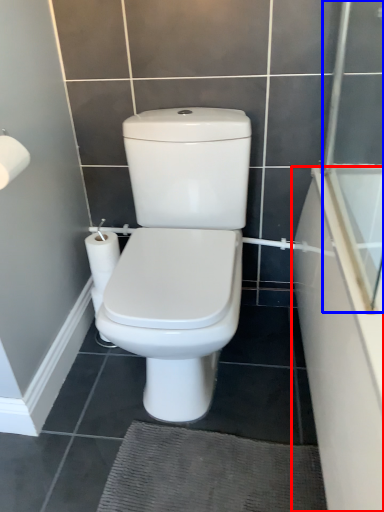
Question: Which of the following is the farthest to the observer, bath (highlighted by a red box) or screen door (highlighted by a blue box)?

Choices:
 (A) bath
 (B) screen door

Answer: (B)